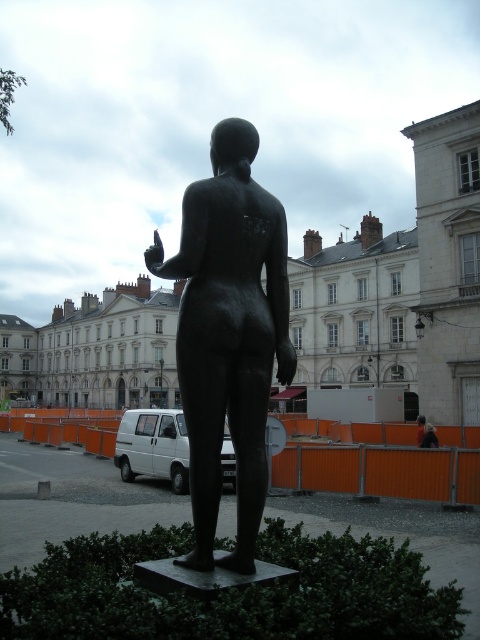
Is bronze statue at center to the left of blurred fabric woman at center from the viewer's perspective?

Indeed, bronze statue at center is positioned on the left side of blurred fabric woman at center.

Is point (225, 342) less distant than point (429, 444)?

Yes, it is.

Locate an element on the screen. This screenshot has height=640, width=480. bronze statue at center is located at coordinates [228, 333].